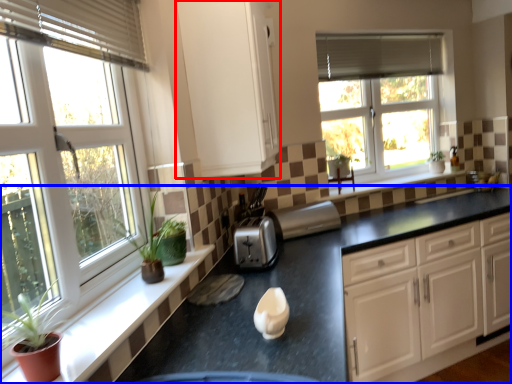
Question: Among these objects, which one is farthest to the camera, cabinetry (highlighted by a red box) or countertop (highlighted by a blue box)?

Choices:
 (A) cabinetry
 (B) countertop

Answer: (A)